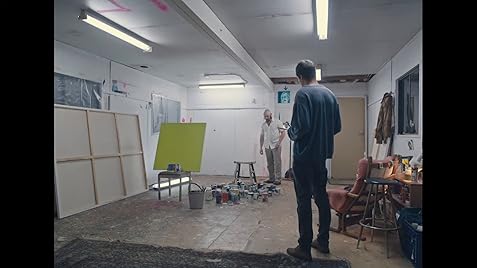
You are a GUI agent. You are given a task and a screenshot of the screen. Output one action in this format:
    pyautogui.click(x=<x>, y=<y>)
    Task: Click on the door
    
    Given the screenshot: What is the action you would take?
    pyautogui.click(x=347, y=114)